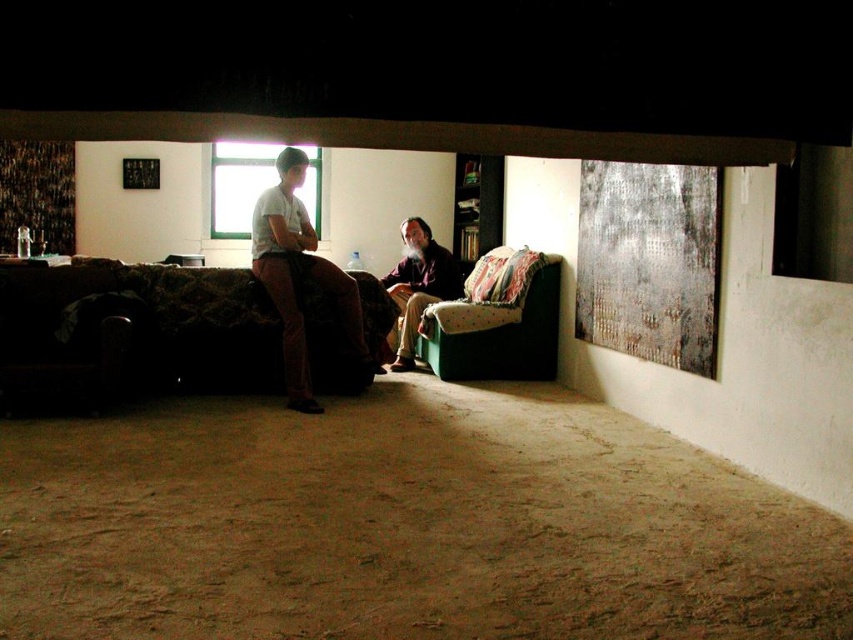
Is dark fabric couch at center shorter than matte white shirt at center?

Yes, dark fabric couch at center is shorter than matte white shirt at center.

Which is below, dark fabric couch at center or matte white shirt at center?

dark fabric couch at center is below.

Which is behind, point (373, 348) or point (256, 211)?

The point (373, 348) is more distant.

Where is `dark fabric couch at center`? The height and width of the screenshot is (640, 853). dark fabric couch at center is located at coordinates (186, 330).

Can you confirm if matte white shirt at center is positioned to the right of beige fabric couch at center?

Incorrect, matte white shirt at center is not on the right side of beige fabric couch at center.

The height and width of the screenshot is (640, 853). What are the coordinates of `matte white shirt at center` in the screenshot? It's located at (x=300, y=278).

This screenshot has width=853, height=640. I want to click on matte white shirt at center, so click(300, 278).

How much distance is there between dark fabric couch at center and beige fabric couch at center?

A distance of 1.38 meters exists between dark fabric couch at center and beige fabric couch at center.

Where is `dark fabric couch at center`? dark fabric couch at center is located at coordinates (186, 330).